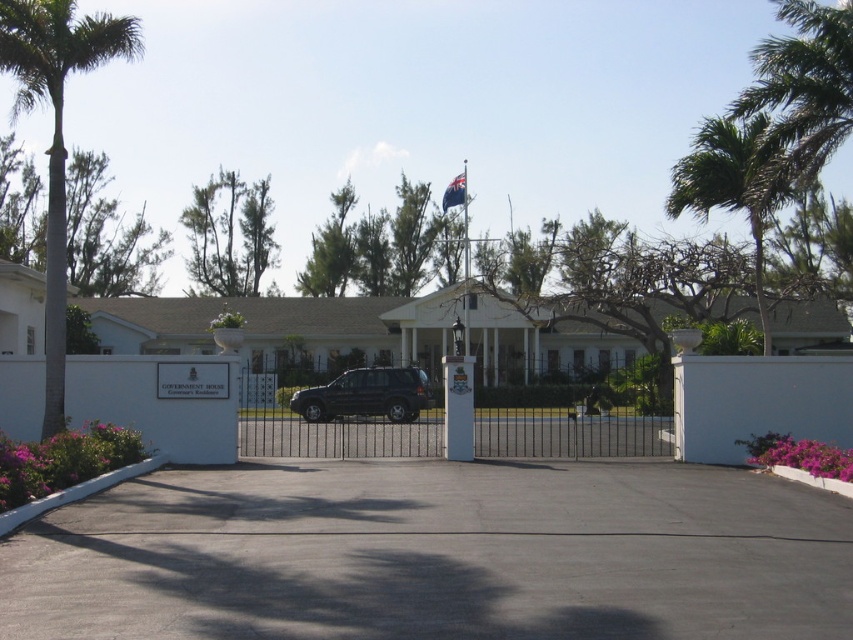
Which is in front, point (467, 289) or point (461, 200)?

Point (467, 289)

Does point (465, 168) lie behind point (457, 193)?

Yes, point (465, 168) is behind point (457, 193).

Does point (463, 353) come behind point (453, 204)?

No, it is not.

Where is `metallic flag pole at center`? metallic flag pole at center is located at coordinates (465, 259).

Between black asphalt driveway at center and black wrought iron gate at center, which one is positioned higher?

black asphalt driveway at center is higher up.

I want to click on black asphalt driveway at center, so click(434, 554).

Which is in front, point (83, 513) or point (422, 452)?

Point (83, 513)

The width and height of the screenshot is (853, 640). In order to click on black asphalt driveway at center in this screenshot , I will do point(434,554).

Is shiny black suv at center smaller than metallic flag pole at center?

Yes, shiny black suv at center is smaller than metallic flag pole at center.

At what (x,y) coordinates should I click in order to perform the action: click on shiny black suv at center. Please return your answer as a coordinate pair (x, y). The width and height of the screenshot is (853, 640). Looking at the image, I should click on (364, 394).